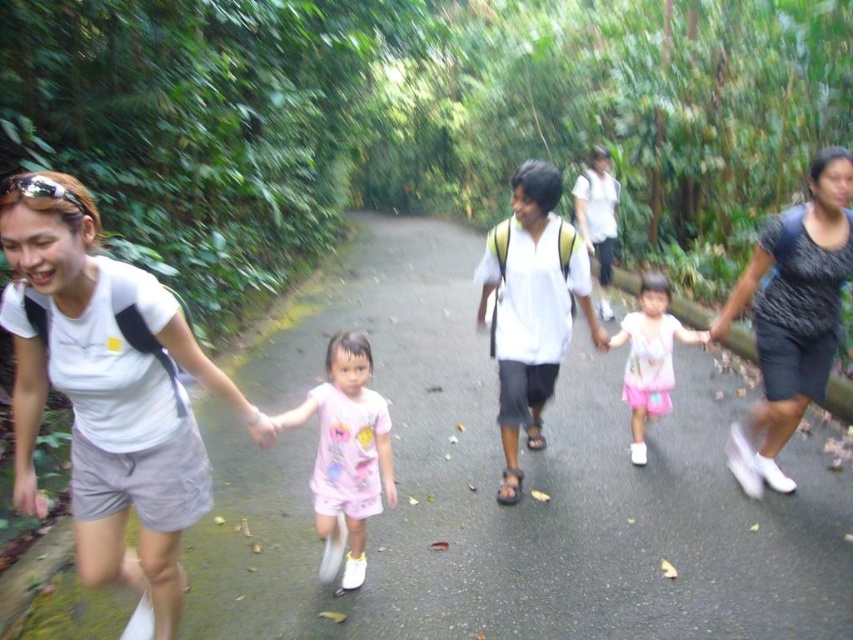
Question: Among these points, which one is farthest from the camera?

Choices:
 (A) (318, 390)
 (B) (666, 401)
 (C) (460, 547)
 (D) (786, 227)

Answer: (B)

Question: Can you confirm if asphalt road at center is positioned to the left of pink fabric dress at center?

Choices:
 (A) no
 (B) yes

Answer: (B)

Question: Estimate the real-world distances between objects in this image. Which object is farther from the dark gray dress at right?

Choices:
 (A) white matte t-shirt at left
 (B) pink fabric dress at center

Answer: (A)

Question: Which of the following is the closest to the observer?

Choices:
 (A) pink fabric dress at center
 (B) white matte t-shirt at left
 (C) pink cotton dress at center

Answer: (B)

Question: Does dark gray dress at right have a greater width compared to pink fabric dress at center?

Choices:
 (A) yes
 (B) no

Answer: (B)

Question: Is the position of white matte t-shirt at left more distant than that of dark gray dress at right?

Choices:
 (A) yes
 (B) no

Answer: (B)